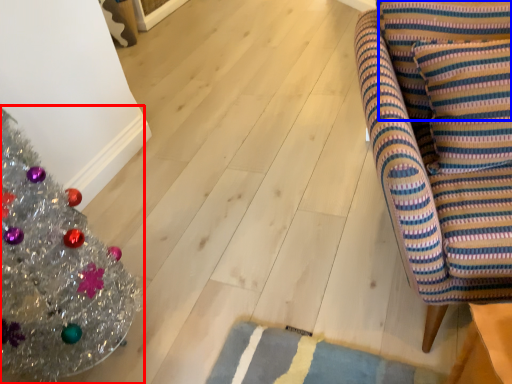
Question: Which point is further to the camera, christmas tree (highlighted by a red box) or pillow (highlighted by a blue box)?

Choices:
 (A) christmas tree
 (B) pillow

Answer: (B)